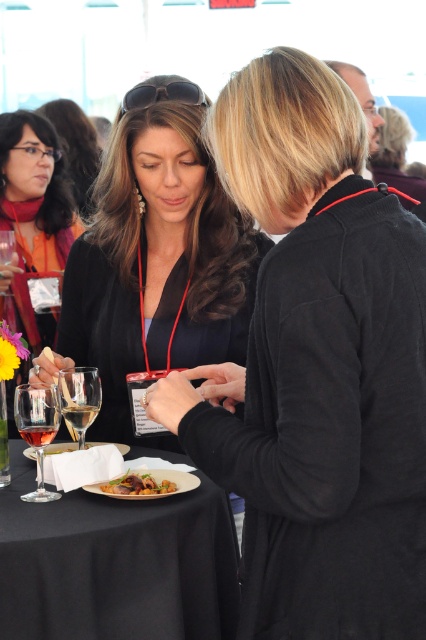
Question: Is clear glass wine glass at lower left to the right of golden brown crispy pastry at center from the viewer's perspective?

Choices:
 (A) no
 (B) yes

Answer: (A)

Question: Among these objects, which one is nearest to the camera?

Choices:
 (A) golden brown crispy pastry at center
 (B) translucent glass wine glass at lower left
 (C) black fabric table at center

Answer: (C)

Question: Which of the following is the closest to the observer?

Choices:
 (A) (65, 417)
 (B) (43, 438)
 (C) (152, 484)
 (D) (118, 186)

Answer: (B)

Question: Does matte black blazer at center have a lesser width compared to golden brown crispy pastry at center?

Choices:
 (A) yes
 (B) no

Answer: (B)

Question: Which point is farther from the camera taking this photo?

Choices:
 (A) (8, 244)
 (B) (26, 625)
 (C) (95, 412)
 (D) (146, 301)

Answer: (A)

Question: Can you confirm if translucent glass wine glass at lower left is bigger than golden brown crispy pastry at center?

Choices:
 (A) no
 (B) yes

Answer: (B)